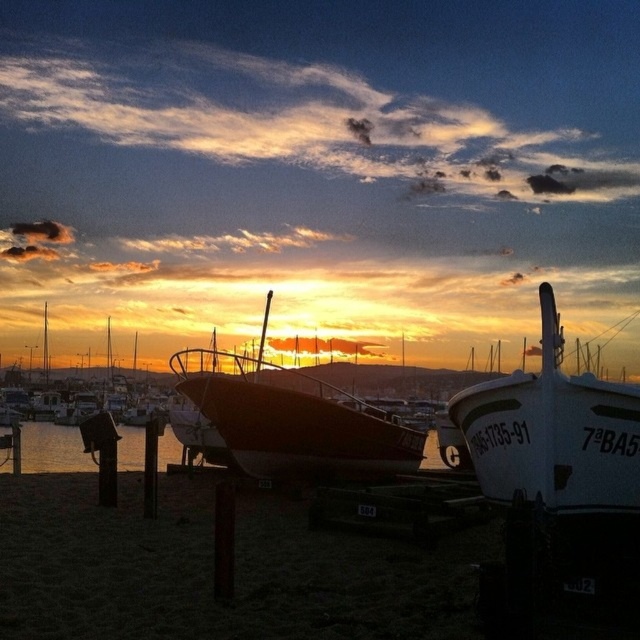
Question: Among these objects, which one is nearest to the camera?

Choices:
 (A) white glossy boat at center
 (B) shiny red boat at center

Answer: (A)

Question: Can you confirm if white glossy boat at center is positioned above shiny red boat at center?

Choices:
 (A) no
 (B) yes

Answer: (A)

Question: From the image, what is the correct spatial relationship of white glossy boat at center in relation to shiny red boat at center?

Choices:
 (A) above
 (B) below

Answer: (B)

Question: Does white glossy boat at center have a lesser width compared to shiny red boat at center?

Choices:
 (A) no
 (B) yes

Answer: (B)

Question: Which object appears closest to the camera in this image?

Choices:
 (A) white glossy boat at center
 (B) shiny red boat at center

Answer: (A)